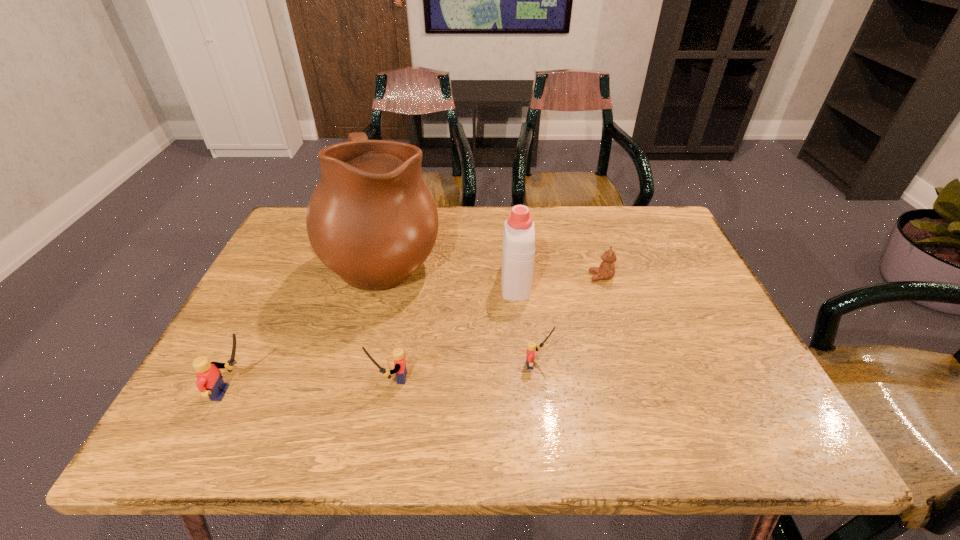
At what (x,y) coordinates should I click in order to perform the action: click on vacant region located on the front-facing side of the second shortest Lego. Please return your answer as a coordinate pair (x, y). Looking at the image, I should click on (283, 378).

Locate an element on the screen. vacant region located 0.260m on the front-facing side of the second shortest Lego is located at coordinates tap(250, 378).

The width and height of the screenshot is (960, 540). I want to click on vacant region located 0.210m on the front-facing side of the rightmost Lego, so (649, 364).

Locate an element on the screen. The width and height of the screenshot is (960, 540). vacant area situated at the spout of the tallest object is located at coordinates (583, 257).

At what (x,y) coordinates should I click in order to perform the action: click on free space located on the handle side of the detergent. Please return your answer as a coordinate pair (x, y). This screenshot has width=960, height=540. Looking at the image, I should click on (510, 219).

At what (x,y) coordinates should I click in order to perform the action: click on free space located on the handle side of the detergent. Please return your answer as a coordinate pair (x, y). Looking at the image, I should click on (512, 241).

The width and height of the screenshot is (960, 540). I want to click on vacant space situated 0.110m on the handle side of the detergent, so click(x=512, y=239).

This screenshot has height=540, width=960. Find the location of `free region located on the face of the rightmost object`. free region located on the face of the rightmost object is located at coordinates (499, 276).

In order to click on free location located 0.230m on the face of the rightmost object in this screenshot , I will do `click(503, 276)`.

You are a GUI agent. You are given a task and a screenshot of the screen. Output one action in this format:
    pyautogui.click(x=<x>, y=<y>)
    Task: Click on the vacant area located 0.330m on the face of the rightmost object
    The width and height of the screenshot is (960, 540).
    Given the screenshot: What is the action you would take?
    pyautogui.click(x=465, y=276)